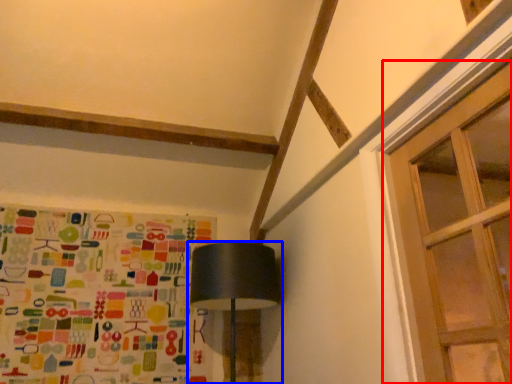
Question: Which of the following is the farthest to the observer, window (highlighted by a red box) or lamp (highlighted by a blue box)?

Choices:
 (A) window
 (B) lamp

Answer: (B)